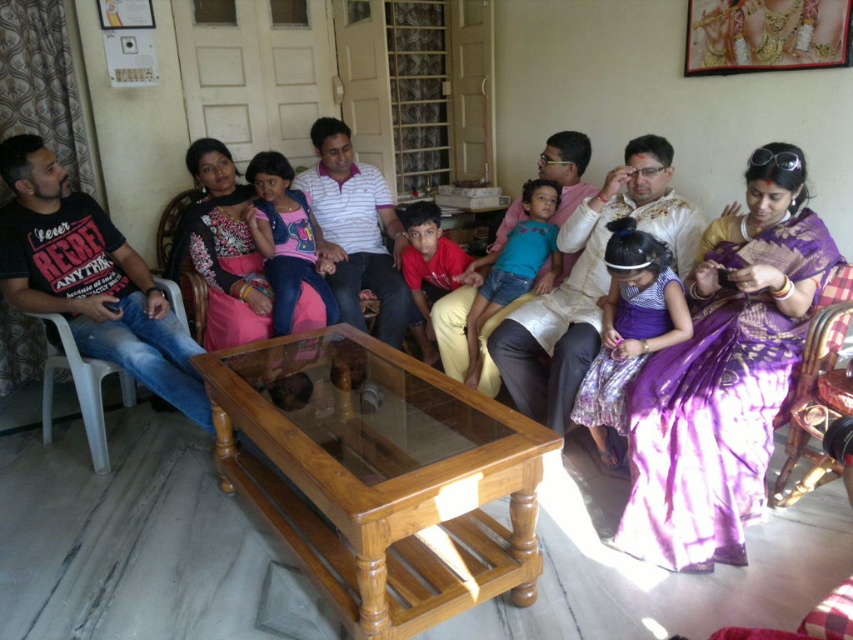
Question: Which of the following is the closest to the observer?

Choices:
 (A) (703, 490)
 (B) (219, 296)

Answer: (A)

Question: Does purple silk saree at center appear over matte pink saree at center?

Choices:
 (A) no
 (B) yes

Answer: (A)

Question: Among these points, which one is nearest to the camera?

Choices:
 (A) (720, 420)
 (B) (221, 253)

Answer: (A)

Question: Which object appears closest to the camera in this image?

Choices:
 (A) purple silk saree at center
 (B) matte pink saree at center

Answer: (A)

Question: Can you confirm if purple silk saree at center is positioned to the right of matte pink saree at center?

Choices:
 (A) no
 (B) yes

Answer: (B)

Question: Can you confirm if purple silk saree at center is bigger than matte pink saree at center?

Choices:
 (A) yes
 (B) no

Answer: (A)